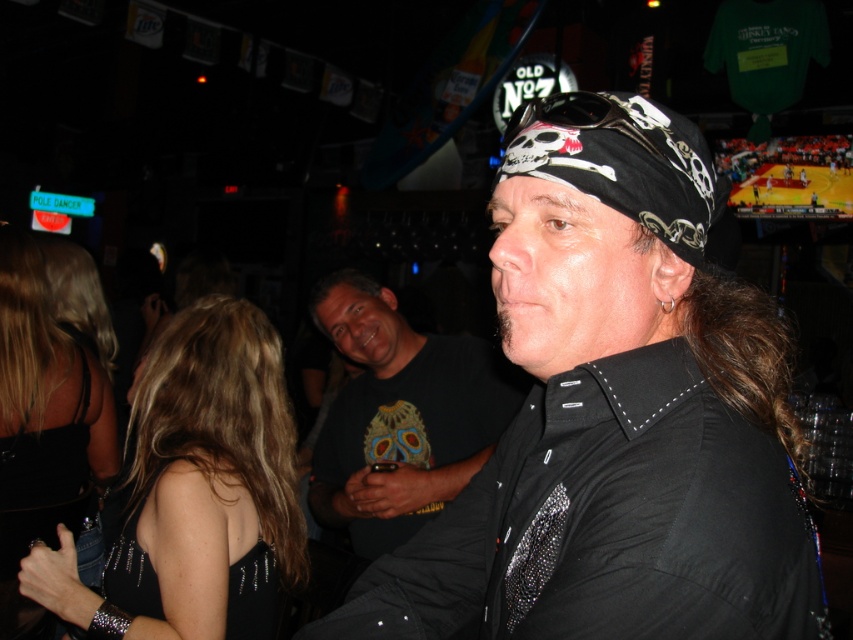
Who is more distant from viewer, (154, 538) or (99, 397)?

Point (99, 397)

Is black sequined dress at left below black satin dress at lower left?

Correct, black sequined dress at left is located below black satin dress at lower left.

Is point (250, 561) positioned in front of point (59, 438)?

Yes, point (250, 561) is closer to viewer.

This screenshot has width=853, height=640. In order to click on black sequined dress at left in this screenshot , I will do `click(195, 492)`.

Does black satin shirt at center have a larger size compared to black textured shirt at center?

Actually, black satin shirt at center might be smaller than black textured shirt at center.

Can you confirm if black satin shirt at center is positioned to the right of black textured shirt at center?

Correct, you'll find black satin shirt at center to the right of black textured shirt at center.

Between point (543, 396) and point (383, 420), which one is positioned in front?

Point (543, 396) is more forward.

Locate an element on the screen. black satin shirt at center is located at coordinates (614, 413).

Describe the element at coordinates (614, 413) in the screenshot. I see `black satin shirt at center` at that location.

Which is above, black satin shirt at center or black satin dress at lower left?

Answer: black satin shirt at center is above.

Is point (798, 499) closer to viewer compared to point (53, 529)?

That is True.

Locate an element on the screen. black satin shirt at center is located at coordinates (614, 413).